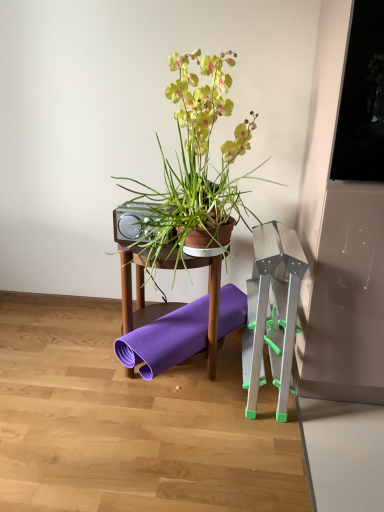
Question: From a real-world perspective, is transparent glass window screen at upper right physically located above or below metallic silver speaker at center?

Choices:
 (A) below
 (B) above

Answer: (B)

Question: From their relative heights in the image, would you say transparent glass window screen at upper right is taller or shorter than metallic silver speaker at center?

Choices:
 (A) short
 (B) tall

Answer: (B)

Question: Based on their relative distances, which object is nearer to the metallic silver speaker at center?

Choices:
 (A) silver metallic step stool at right
 (B) wooden table at center
 (C) matte brown pot at center
 (D) transparent glass window screen at upper right

Answer: (B)

Question: Which is nearer to the metallic silver speaker at center?

Choices:
 (A) transparent glass window screen at upper right
 (B) matte brown pot at center
 (C) wooden table at center
 (D) silver metallic step stool at right

Answer: (C)